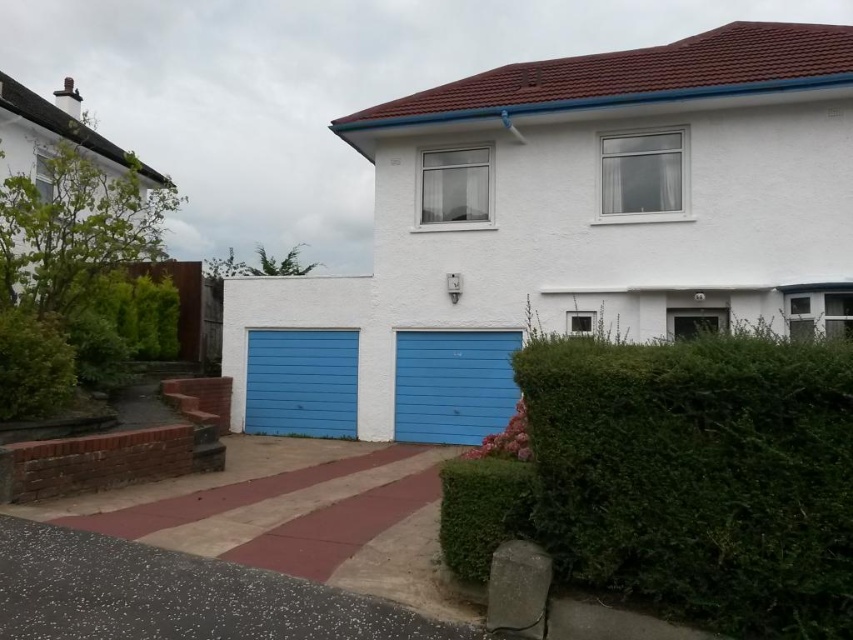
Consider the image. Can you confirm if blue painted wood garage at center is positioned above speckled asphalt driveway at lower center?

Indeed, blue painted wood garage at center is positioned over speckled asphalt driveway at lower center.

Find the location of a particular element. The width and height of the screenshot is (853, 640). blue painted wood garage at center is located at coordinates (579, 216).

You are a GUI agent. You are given a task and a screenshot of the screen. Output one action in this format:
    pyautogui.click(x=<x>, y=<y>)
    Task: Click on the blue painted wood garage at center
    
    Given the screenshot: What is the action you would take?
    pyautogui.click(x=579, y=216)

Between point (834, 568) and point (395, 340), which one is positioned in front?

Positioned in front is point (834, 568).

Does point (820, 376) come behind point (451, 401)?

No, (820, 376) is in front of (451, 401).

Between point (682, 419) and point (422, 376), which one is positioned behind?

The point (422, 376) is behind.

Locate an element on the screen. green leafy hedge at lower right is located at coordinates (698, 474).

Based on the photo, does speckled asphalt driveway at lower center have a larger size compared to matte blue garage door at center?

Actually, speckled asphalt driveway at lower center might be smaller than matte blue garage door at center.

Does speckled asphalt driveway at lower center have a lesser height compared to matte blue garage door at center?

Yes, speckled asphalt driveway at lower center is shorter than matte blue garage door at center.

You are a GUI agent. You are given a task and a screenshot of the screen. Output one action in this format:
    pyautogui.click(x=<x>, y=<y>)
    Task: Click on the speckled asphalt driveway at lower center
    Image resolution: width=853 pixels, height=640 pixels.
    Given the screenshot: What is the action you would take?
    pyautogui.click(x=175, y=595)